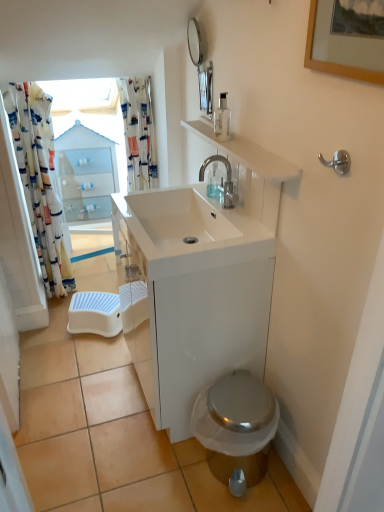
This screenshot has height=512, width=384. What are the coordinates of `free location to the left of shiny metallic toilet at lower right` in the screenshot? It's located at (186, 468).